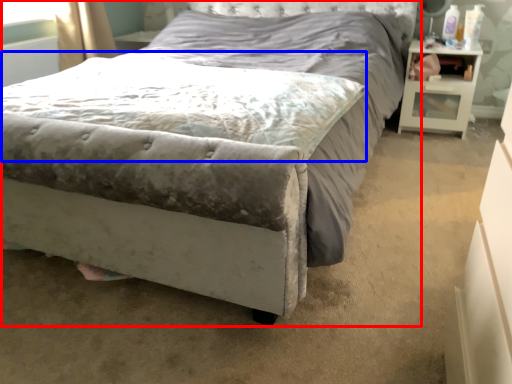
Question: Which point is further to the camera, bed (highlighted by a red box) or mattress (highlighted by a blue box)?

Choices:
 (A) bed
 (B) mattress

Answer: (B)